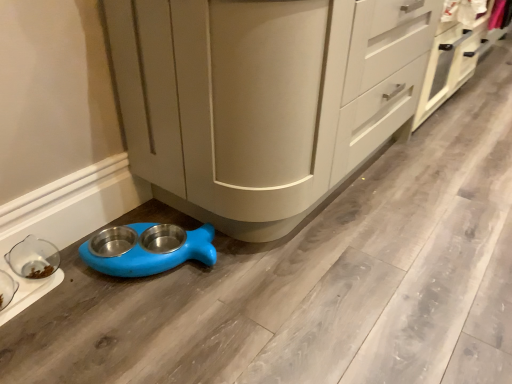
Image resolution: width=512 pixels, height=384 pixels. I want to click on space that is in front of transparent glass bowl at lower left, placed as the second appliance when sorted from right to left, so click(x=26, y=340).